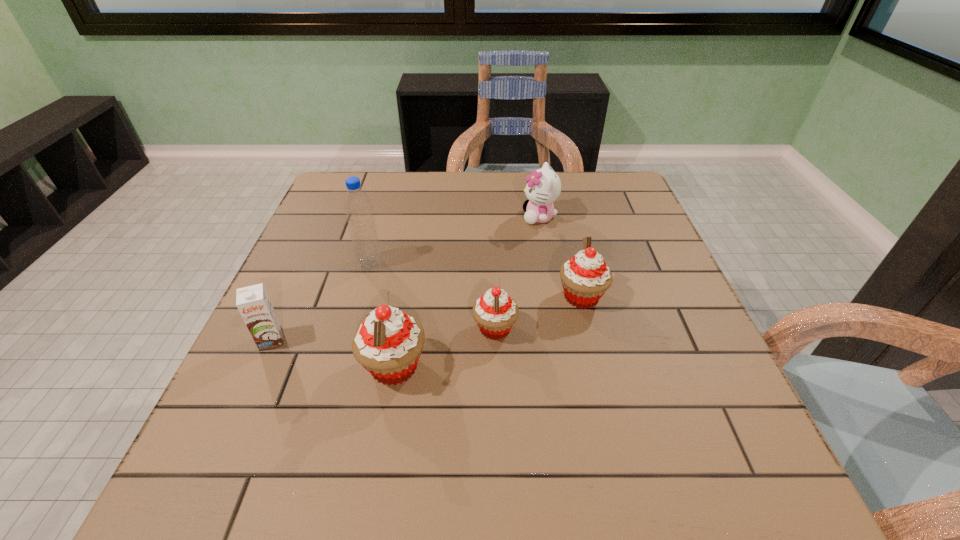
At what (x,y) coordinates should I click in order to perform the action: click on free region at the far edge of the desktop. Please return your answer as a coordinate pair (x, y). This screenshot has width=960, height=540. Looking at the image, I should click on (563, 201).

I want to click on free region at the near edge of the desktop, so click(314, 410).

Where is `vacant space at the left edge of the desktop`? This screenshot has width=960, height=540. vacant space at the left edge of the desktop is located at coordinates (333, 226).

Find the location of a particular element. The height and width of the screenshot is (540, 960). free location at the right edge is located at coordinates (641, 246).

Locate an element on the screen. Image resolution: width=960 pixels, height=540 pixels. vacant point at the far right corner is located at coordinates (613, 198).

Find the location of a particular element. The width and height of the screenshot is (960, 540). free space between the farthest object and the second tallest cupcake is located at coordinates (561, 256).

At what (x,y) coordinates should I click in order to perform the action: click on free space between the chocolate milk and the fourth object from right to left. Please return your answer as a coordinate pair (x, y). Looking at the image, I should click on (x=332, y=353).

Find the location of `free space between the kitten and the leftmost object`. free space between the kitten and the leftmost object is located at coordinates (405, 278).

At what (x,y) coordinates should I click in order to perform the action: click on unoccupied area between the chocolate milk and the farthest object. Please return your answer as a coordinate pair (x, y). The image size is (960, 540). Looking at the image, I should click on (405, 278).

I want to click on vacant area between the second shortest cupcake and the fourth object from left to right, so click(539, 313).